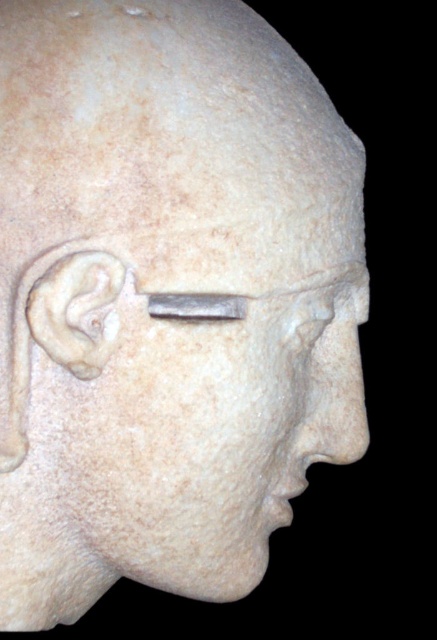
Between point (34, 35) and point (107, 276), which one is positioned behind?

The point (34, 35) is more distant.

Is point (124, 100) positioned after point (24, 371)?

No, it is in front of (24, 371).

Which is behind, point (236, 131) or point (41, 292)?

The point (236, 131) is more distant.

Identify the location of matte stone forehead at upper center. The width and height of the screenshot is (437, 640). point(169,132).